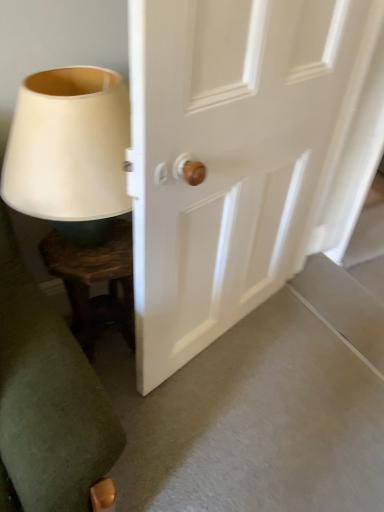
You are a GUI agent. You are given a task and a screenshot of the screen. Output one action in this format:
    pyautogui.click(x=<x>, y=<y>)
    Task: Click on the free spot above dark wood side table at lower left (from a real-world perspective)
    The image size is (384, 512).
    Given the screenshot: What is the action you would take?
    pyautogui.click(x=88, y=253)